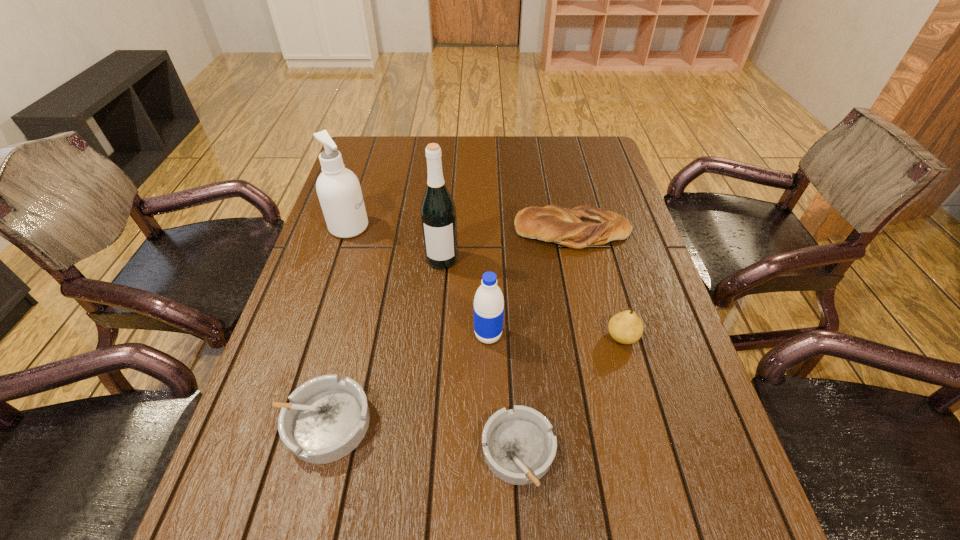
I want to click on the second shortest object, so click(x=327, y=417).

You are a GUI agent. You are given a task and a screenshot of the screen. Output one action in this format:
    pyautogui.click(x=<x>, y=<y>)
    Task: Click on the left ashtray
    Image resolution: width=960 pixels, height=540 pixels.
    Given the screenshot: What is the action you would take?
    pos(327,417)

The height and width of the screenshot is (540, 960). In order to click on the right ashtray in this screenshot , I will do `click(519, 446)`.

This screenshot has width=960, height=540. In order to click on the shorter ashtray in this screenshot , I will do `click(519, 446)`.

I want to click on wine bottle, so click(438, 212).

The image size is (960, 540). Find the location of `bread`. bread is located at coordinates (582, 226).

What are the coordinates of `cleansing agent` in the screenshot? It's located at (338, 189).

Locate an element on the screen. the third tallest object is located at coordinates (488, 306).

This screenshot has height=540, width=960. I want to click on pear, so click(x=626, y=327).

This screenshot has height=540, width=960. I want to click on free location located 0.300m on the back of the taller ashtray, so [361, 282].